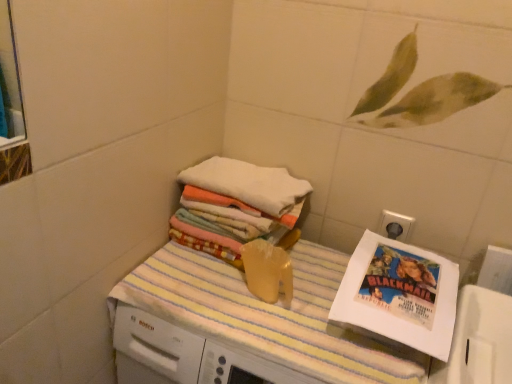
Where is `vacant area in front of white paper comic book at right`? The width and height of the screenshot is (512, 384). vacant area in front of white paper comic book at right is located at coordinates (371, 359).